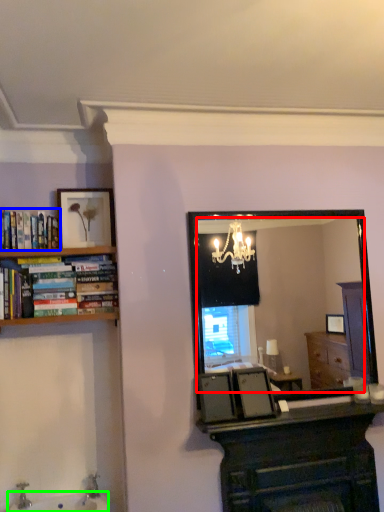
Question: Considering the real-world distances, which object is closest to mirror (highlighted by a red box)? book (highlighted by a blue box) or sink (highlighted by a green box).

Choices:
 (A) book
 (B) sink

Answer: (A)